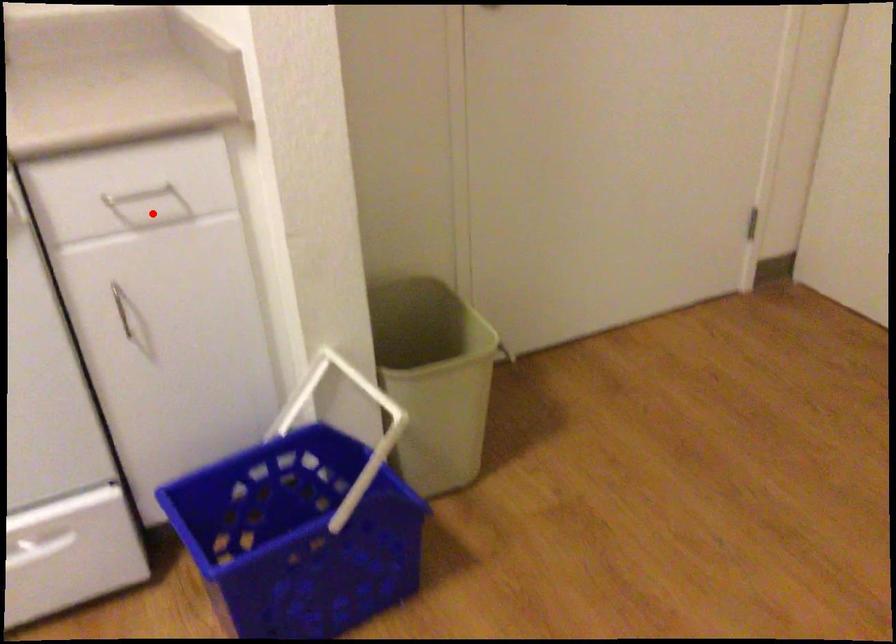
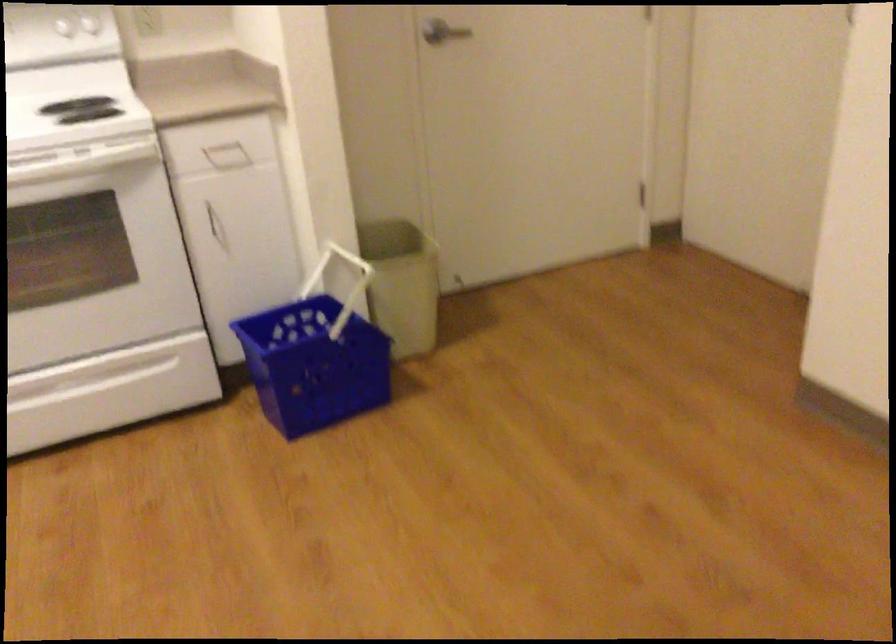
Find the pixel in the second image that matches the highlighted location in the first image.

(227, 156)